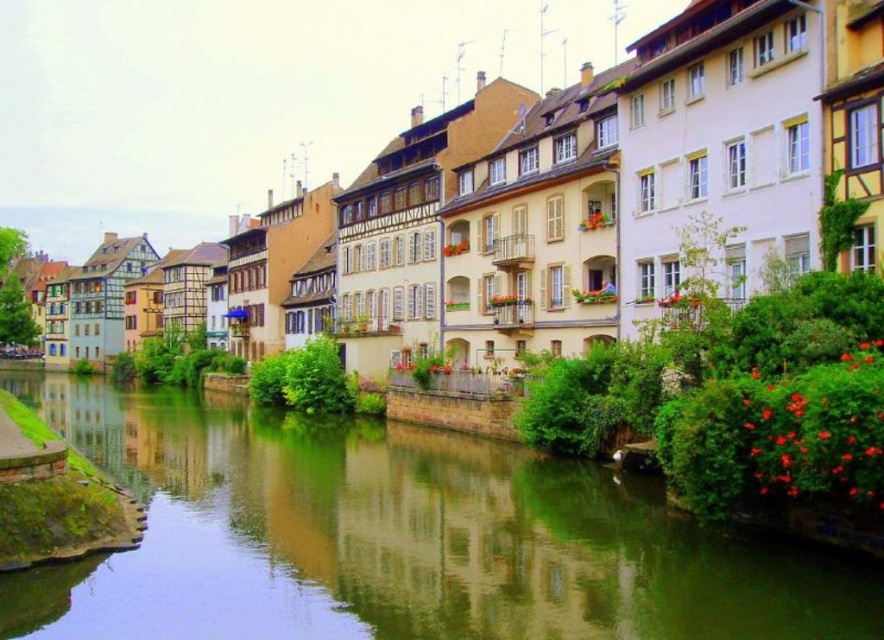
You are a tourist standing on the riverside path and want to take a photo that includes both the green stone river at center and the matte beige building at center. Which object should you position closer to the edge of your camera frame to ensure both fit in the shot?

Since the green stone river at center is narrower than the matte beige building at center, you should position the green stone river at center closer to the edge of your camera frame to ensure both fit in the shot.

You are a tourist standing on the riverside path. You see the green stone river at center and the matte beige building at center. Which one is closer to your feet?

The green stone river at center is closer to your feet because it is positioned below the matte beige building at center.

You are standing at the riverside in a European town and see the point marked at coordinates [397,538]. What does this point indicate?

The point at coordinates [397,538] marks the green stone river at center.